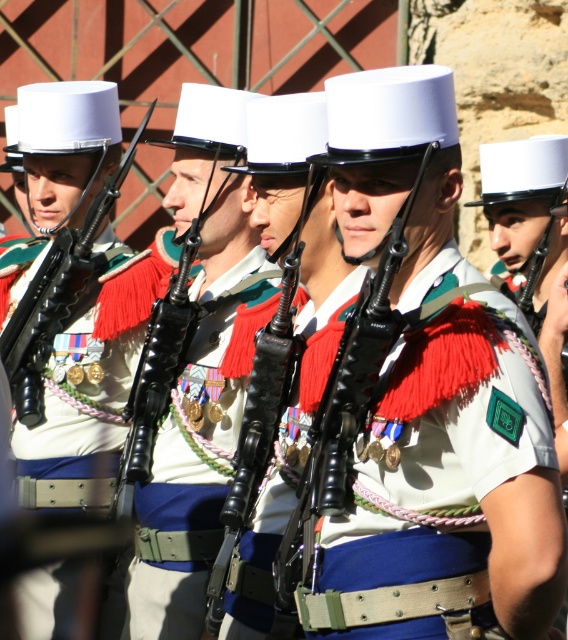
You are a photographer trying to capture a clear photo of the shiny black rifle at center and the matte white uniform at center. Since you want both to be in focus, which object should you adjust your camera focus on first, considering their sizes?

The matte white uniform at center is larger than the shiny black rifle at center, so you should focus on the larger matte white uniform at center first to ensure both are in focus.

You are standing at a safe distance observing the military formation. The point at coordinates point (411,285) is part of the formation. If you want to throw a small object to reach that point, what is the minimum distance you need to throw it?

The point at coordinates point (411,285) is 38.98 meters away from the viewer, so you would need to throw the object at least 38.98 meters to reach it.

You are a photographer positioned at the front of the formation. You want to take a photo that includes both the point at coordinates point (x=94, y=124) and point (x=213, y=556). Which point is closer to your camera lens?

The point at coordinates point (x=94, y=124) is closer to the camera lens because it is further to the viewer than point (x=213, y=556).